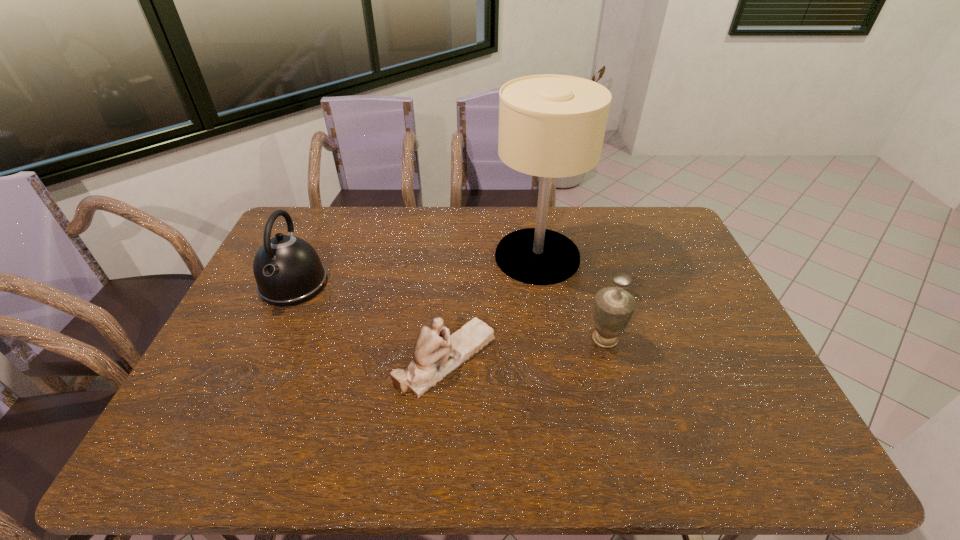
The height and width of the screenshot is (540, 960). Find the location of `object that is positioned at the left edge`. object that is positioned at the left edge is located at coordinates (288, 271).

The width and height of the screenshot is (960, 540). I want to click on blank area at the far edge, so click(x=555, y=221).

This screenshot has height=540, width=960. I want to click on free point at the left edge, so click(226, 346).

Identify the location of vacant point at the right edge. Image resolution: width=960 pixels, height=540 pixels. (690, 284).

Find the location of a particular element. The image size is (960, 540). free space at the far left corner is located at coordinates (317, 235).

Locate an element on the screen. The image size is (960, 540). free region at the far right corner is located at coordinates (660, 221).

Locate an element on the screen. The image size is (960, 540). free point between the kettle and the figurine is located at coordinates (371, 321).

Image resolution: width=960 pixels, height=540 pixels. In order to click on vacant area that lies between the shortest object and the urn in this screenshot , I will do `click(526, 348)`.

Image resolution: width=960 pixels, height=540 pixels. I want to click on free spot between the second object from left to right and the kettle, so click(371, 321).

Where is `vacant space that's between the second object from left to right and the leftmost object`? vacant space that's between the second object from left to right and the leftmost object is located at coordinates (371, 321).